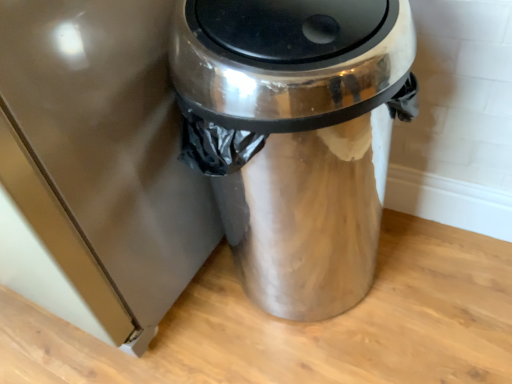
Identify the location of polished stainless steel trash can at center. (295, 136).

Describe the element at coordinates (295, 136) in the screenshot. The height and width of the screenshot is (384, 512). I see `polished stainless steel trash can at center` at that location.

Locate an element on the screen. The width and height of the screenshot is (512, 384). polished stainless steel trash can at center is located at coordinates (295, 136).